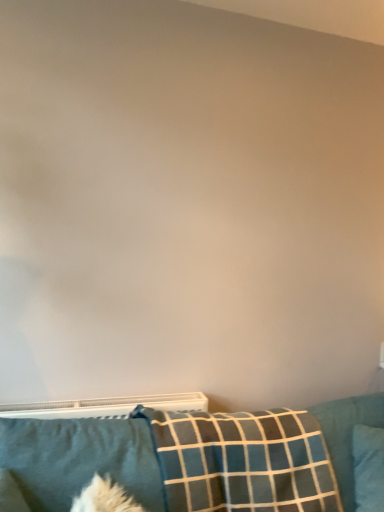
What is the approximate height of plaid fabric pillow at lower center, acting as the second pillow starting from the right?

plaid fabric pillow at lower center, acting as the second pillow starting from the right, is 65.70 centimeters tall.

What do you see at coordinates (79, 459) in the screenshot? This screenshot has height=512, width=384. I see `soft blue fabric pillow at lower left, acting as the 3th pillow starting from the right` at bounding box center [79, 459].

Locate an element on the screen. The height and width of the screenshot is (512, 384). teal fabric couch at lower center is located at coordinates (197, 457).

From a real-world perspective, is soft blue fabric pillow at lower left, acting as the 3th pillow starting from the right, on plaid fabric pillow at lower center, acting as the second pillow starting from the right?

Yes.

From the image's perspective, is soft blue fabric pillow at lower left, acting as the 3th pillow starting from the right, located beneath plaid fabric pillow at lower center, the second pillow positioned from the left?

No, from the image's perspective, soft blue fabric pillow at lower left, acting as the 3th pillow starting from the right, is not beneath plaid fabric pillow at lower center, the second pillow positioned from the left.

Does soft blue fabric pillow at lower left, acting as the 3th pillow starting from the right, come in front of teal fabric couch at lower center?

No, the depth of soft blue fabric pillow at lower left, acting as the 3th pillow starting from the right, is greater than that of teal fabric couch at lower center.

Based on their sizes in the image, would you say soft blue fabric pillow at lower left, acting as the 3th pillow starting from the right, is bigger or smaller than teal fabric couch at lower center?

Clearly, soft blue fabric pillow at lower left, acting as the 3th pillow starting from the right, is smaller in size than teal fabric couch at lower center.

Is point (43, 486) closer or farther from the camera than point (183, 486)?

Point (43, 486) appears to be closer to the viewer than point (183, 486).

Does soft blue fabric pillow at lower left, acting as the 3th pillow starting from the right, touch teal fabric couch at lower center?

There is a gap between soft blue fabric pillow at lower left, acting as the 3th pillow starting from the right, and teal fabric couch at lower center.

From the picture: Can you confirm if teal fabric couch at lower center is bigger than plaid fabric pillow at lower center, acting as the second pillow starting from the right?

Yes, teal fabric couch at lower center is bigger than plaid fabric pillow at lower center, acting as the second pillow starting from the right.

Considering the sizes of objects teal fabric couch at lower center and plaid fabric pillow at lower center, acting as the second pillow starting from the right, in the image provided, who is wider, teal fabric couch at lower center or plaid fabric pillow at lower center, acting as the second pillow starting from the right,?

With larger width is teal fabric couch at lower center.

Based on the photo, from the image's perspective, who appears lower, teal fabric couch at lower center or plaid fabric pillow at lower center, the second pillow positioned from the left?

teal fabric couch at lower center, from the image's perspective.

Image resolution: width=384 pixels, height=512 pixels. Find the location of `pillow that is the 2nd one above the blue fabric pillow at lower right, which appears as the third pillow when viewed from the left (from a real-world perspective)`. pillow that is the 2nd one above the blue fabric pillow at lower right, which appears as the third pillow when viewed from the left (from a real-world perspective) is located at coordinates (79, 459).

From a real-world perspective, which object stands above the other?

In real-world perspective, soft blue fabric pillow at lower left, acting as the 3th pillow starting from the right, is above.

Can we say soft blue fabric pillow at lower left, which ranks as the first pillow in left-to-right order, lies outside blue fabric pillow at lower right, which is counted as the first pillow, starting from the right?

Indeed, soft blue fabric pillow at lower left, which ranks as the first pillow in left-to-right order, is completely outside blue fabric pillow at lower right, which is counted as the first pillow, starting from the right.

From the image's perspective, is soft blue fabric pillow at lower left, which ranks as the first pillow in left-to-right order, on top of blue fabric pillow at lower right, which is counted as the first pillow, starting from the right?

Correct, soft blue fabric pillow at lower left, which ranks as the first pillow in left-to-right order, appears higher than blue fabric pillow at lower right, which is counted as the first pillow, starting from the right, in the image.

Can you confirm if plaid fabric pillow at lower center, acting as the second pillow starting from the right, is shorter than blue fabric pillow at lower right, which is counted as the first pillow, starting from the right?

No, plaid fabric pillow at lower center, acting as the second pillow starting from the right, is not shorter than blue fabric pillow at lower right, which is counted as the first pillow, starting from the right.

From the image's perspective, does plaid fabric pillow at lower center, acting as the second pillow starting from the right, appear higher than blue fabric pillow at lower right, which appears as the third pillow when viewed from the left?

Yes.

Does point (236, 488) appear closer or farther from the camera than point (373, 440)?

Clearly, point (236, 488) is closer to the camera than point (373, 440).

Between plaid fabric pillow at lower center, acting as the second pillow starting from the right, and blue fabric pillow at lower right, which appears as the third pillow when viewed from the left, which one appears on the right side from the viewer's perspective?

From the viewer's perspective, blue fabric pillow at lower right, which appears as the third pillow when viewed from the left, appears more on the right side.

Could you tell me if blue fabric pillow at lower right, which appears as the third pillow when viewed from the left, is turned towards plaid fabric pillow at lower center, acting as the second pillow starting from the right?

No, blue fabric pillow at lower right, which appears as the third pillow when viewed from the left, is not turned towards plaid fabric pillow at lower center, acting as the second pillow starting from the right.

Consider the image. Is blue fabric pillow at lower right, which is counted as the first pillow, starting from the right, positioned in front of plaid fabric pillow at lower center, the second pillow positioned from the left?

No, blue fabric pillow at lower right, which is counted as the first pillow, starting from the right, is further to the viewer.

Is blue fabric pillow at lower right, which appears as the third pillow when viewed from the left, far away from plaid fabric pillow at lower center, acting as the second pillow starting from the right?

No, blue fabric pillow at lower right, which appears as the third pillow when viewed from the left, is not far from plaid fabric pillow at lower center, acting as the second pillow starting from the right.

Image resolution: width=384 pixels, height=512 pixels. Identify the location of pillow below the plaid fabric pillow at lower center, acting as the second pillow starting from the right (from a real-world perspective). (368, 467).

Which object is further away from the camera, blue fabric pillow at lower right, which appears as the third pillow when viewed from the left, or teal fabric couch at lower center?

blue fabric pillow at lower right, which appears as the third pillow when viewed from the left, is more distant.

How different are the orientations of blue fabric pillow at lower right, which appears as the third pillow when viewed from the left, and teal fabric couch at lower center in degrees?

28.1 degrees separate the facing orientations of blue fabric pillow at lower right, which appears as the third pillow when viewed from the left, and teal fabric couch at lower center.

This screenshot has height=512, width=384. Identify the location of furniture below the blue fabric pillow at lower right, which is counted as the first pillow, starting from the right (from a real-world perspective). (197, 457).

You are a GUI agent. You are given a task and a screenshot of the screen. Output one action in this format:
    pyautogui.click(x=<x>, y=<y>)
    Task: Click on the 1st pillow behind the soft blue fabric pillow at lower left, acting as the 3th pillow starting from the right, counting from the anchor's position
    This screenshot has width=384, height=512.
    Given the screenshot: What is the action you would take?
    pyautogui.click(x=242, y=461)

The height and width of the screenshot is (512, 384). Find the location of `furniture below the soft blue fabric pillow at lower left, acting as the 3th pillow starting from the right (from the image's perspective)`. furniture below the soft blue fabric pillow at lower left, acting as the 3th pillow starting from the right (from the image's perspective) is located at coordinates (197, 457).

Which object lies nearer to the anchor point plaid fabric pillow at lower center, acting as the second pillow starting from the right, soft blue fabric pillow at lower left, which ranks as the first pillow in left-to-right order, or blue fabric pillow at lower right, which is counted as the first pillow, starting from the right?

Based on the image, soft blue fabric pillow at lower left, which ranks as the first pillow in left-to-right order, appears to be nearer to plaid fabric pillow at lower center, acting as the second pillow starting from the right.

Considering their positions, is plaid fabric pillow at lower center, the second pillow positioned from the left, positioned further to teal fabric couch at lower center than blue fabric pillow at lower right, which appears as the third pillow when viewed from the left?

blue fabric pillow at lower right, which appears as the third pillow when viewed from the left.

Estimate the real-world distances between objects in this image. Which object is closer to blue fabric pillow at lower right, which appears as the third pillow when viewed from the left, plaid fabric pillow at lower center, acting as the second pillow starting from the right, or soft blue fabric pillow at lower left, acting as the 3th pillow starting from the right?

plaid fabric pillow at lower center, acting as the second pillow starting from the right, lies closer to blue fabric pillow at lower right, which appears as the third pillow when viewed from the left, than the other object.

When comparing their distances from blue fabric pillow at lower right, which is counted as the first pillow, starting from the right, does soft blue fabric pillow at lower left, acting as the 3th pillow starting from the right, or plaid fabric pillow at lower center, acting as the second pillow starting from the right, seem closer?

plaid fabric pillow at lower center, acting as the second pillow starting from the right, is closer to blue fabric pillow at lower right, which is counted as the first pillow, starting from the right.

Estimate the real-world distances between objects in this image. Which object is closer to blue fabric pillow at lower right, which is counted as the first pillow, starting from the right, teal fabric couch at lower center or soft blue fabric pillow at lower left, acting as the 3th pillow starting from the right?

teal fabric couch at lower center lies closer to blue fabric pillow at lower right, which is counted as the first pillow, starting from the right, than the other object.

When comparing their distances from blue fabric pillow at lower right, which is counted as the first pillow, starting from the right, does teal fabric couch at lower center or plaid fabric pillow at lower center, the second pillow positioned from the left, seem closer?

Among the two, plaid fabric pillow at lower center, the second pillow positioned from the left, is located nearer to blue fabric pillow at lower right, which is counted as the first pillow, starting from the right.

Based on their spatial positions, is teal fabric couch at lower center or blue fabric pillow at lower right, which is counted as the first pillow, starting from the right, closer to plaid fabric pillow at lower center, the second pillow positioned from the left?

teal fabric couch at lower center is closer to plaid fabric pillow at lower center, the second pillow positioned from the left.

Estimate the real-world distances between objects in this image. Which object is closer to soft blue fabric pillow at lower left, which ranks as the first pillow in left-to-right order, plaid fabric pillow at lower center, acting as the second pillow starting from the right, or teal fabric couch at lower center?

Among the two, teal fabric couch at lower center is located nearer to soft blue fabric pillow at lower left, which ranks as the first pillow in left-to-right order.

Find the location of a particular element. pillow located between teal fabric couch at lower center and plaid fabric pillow at lower center, acting as the second pillow starting from the right, in the depth direction is located at coordinates click(79, 459).

Find the location of a particular element. pillow located between soft blue fabric pillow at lower left, acting as the 3th pillow starting from the right, and blue fabric pillow at lower right, which appears as the third pillow when viewed from the left, in the left-right direction is located at coordinates (242, 461).

Identify the location of furniture between soft blue fabric pillow at lower left, acting as the 3th pillow starting from the right, and blue fabric pillow at lower right, which is counted as the first pillow, starting from the right, in the horizontal direction. (197, 457).